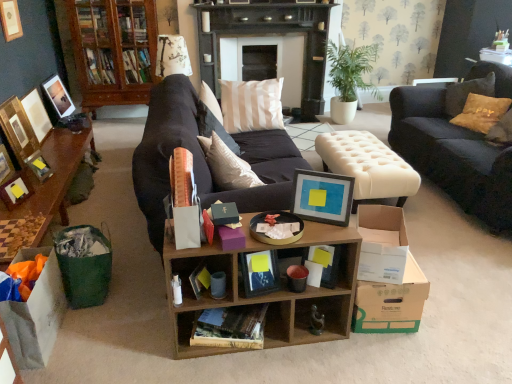
Question: From a real-world perspective, is wooden cabinet at upper left positioned under matte black picture frame at upper left, the 8th picture frame from the right, based on gravity?

Choices:
 (A) no
 (B) yes

Answer: (A)

Question: Is wooden cabinet at upper left positioned beyond the bounds of matte black picture frame at upper left, the 8th picture frame from the right?

Choices:
 (A) yes
 (B) no

Answer: (A)

Question: Does wooden cabinet at upper left come in front of matte black picture frame at upper left, the 8th picture frame from the right?

Choices:
 (A) no
 (B) yes

Answer: (A)

Question: Can you confirm if wooden cabinet at upper left is shorter than matte black picture frame at upper left, which ranks as the 1th picture frame in left-to-right order?

Choices:
 (A) yes
 (B) no

Answer: (B)

Question: Is wooden cabinet at upper left bigger than matte black picture frame at upper left, which ranks as the 1th picture frame in left-to-right order?

Choices:
 (A) no
 (B) yes

Answer: (B)

Question: Considering the relative positions of wooden cabinet at upper left and matte black picture frame at upper left, which ranks as the 1th picture frame in left-to-right order, in the image provided, is wooden cabinet at upper left to the right of matte black picture frame at upper left, which ranks as the 1th picture frame in left-to-right order, from the viewer's perspective?

Choices:
 (A) yes
 (B) no

Answer: (A)

Question: Can you confirm if white striped pillow at center is wider than matte black picture frame at upper left, the 8th picture frame from the right?

Choices:
 (A) yes
 (B) no

Answer: (A)

Question: Considering the relative positions of white striped pillow at center and matte black picture frame at upper left, which ranks as the 1th picture frame in left-to-right order, in the image provided, is white striped pillow at center to the right of matte black picture frame at upper left, which ranks as the 1th picture frame in left-to-right order, from the viewer's perspective?

Choices:
 (A) yes
 (B) no

Answer: (A)

Question: Is white striped pillow at center next to matte black picture frame at upper left, which ranks as the 1th picture frame in left-to-right order, and touching it?

Choices:
 (A) yes
 (B) no

Answer: (B)

Question: Considering the relative sizes of white striped pillow at center and matte black picture frame at upper left, the 8th picture frame from the right, in the image provided, is white striped pillow at center shorter than matte black picture frame at upper left, the 8th picture frame from the right,?

Choices:
 (A) yes
 (B) no

Answer: (B)

Question: Is white striped pillow at center not near matte black picture frame at upper left, which ranks as the 1th picture frame in left-to-right order?

Choices:
 (A) yes
 (B) no

Answer: (A)

Question: From a real-world perspective, is white striped pillow at center physically above matte black picture frame at upper left, which ranks as the 1th picture frame in left-to-right order?

Choices:
 (A) no
 (B) yes

Answer: (A)

Question: Is green leafy plant at center closer to camera compared to wooden cabinet at upper left?

Choices:
 (A) no
 (B) yes

Answer: (B)